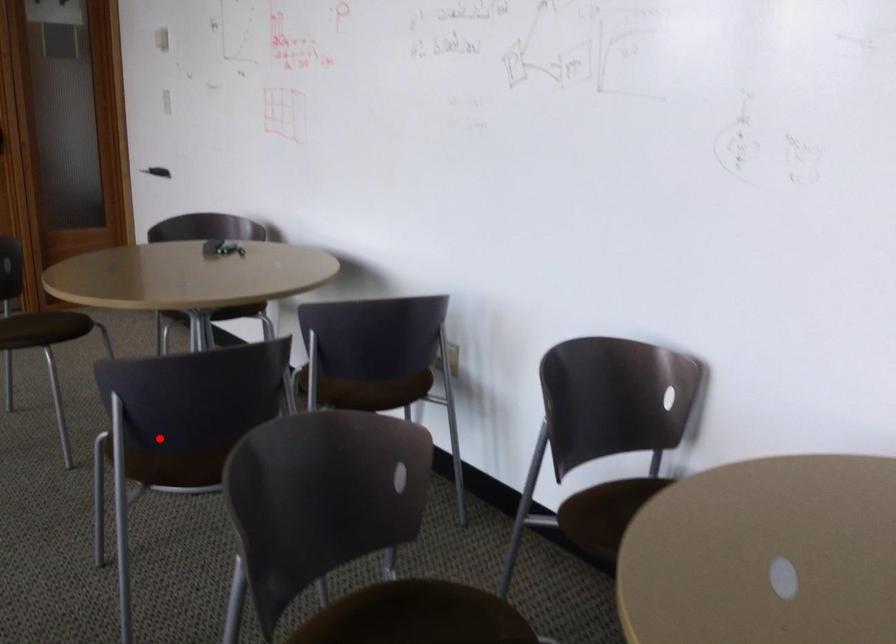
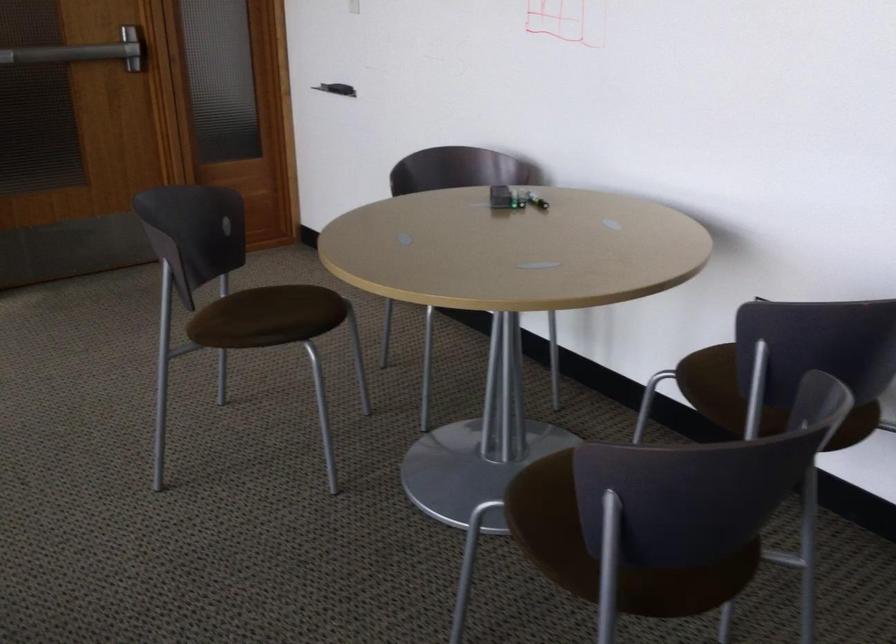
Question: I am providing you with two images of the same scene from different viewpoints. A red point is shown in image1. For the corresponding object point in image2, is it positioned nearer or farther from the camera?

Choices:
 (A) Nearer
 (B) Farther

Answer: (A)